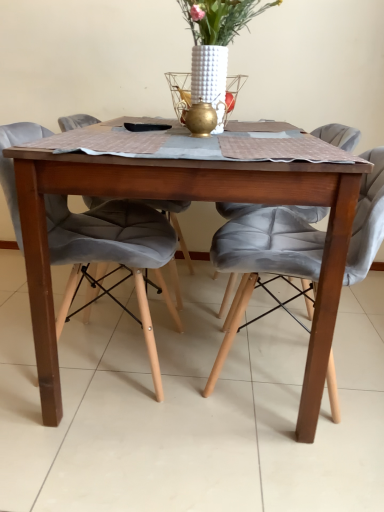
Find the location of a particular element. The width and height of the screenshot is (384, 512). velvet grey chair at center, which is counted as the first chair, starting from the left is located at coordinates (115, 254).

What do you see at coordinates (261, 259) in the screenshot? The height and width of the screenshot is (512, 384). I see `velvet grey chair at center, placed as the second chair when sorted from left to right` at bounding box center [261, 259].

Locate an element on the screen. This screenshot has height=512, width=384. velvet grey chair at center, which is counted as the first chair, starting from the left is located at coordinates (115, 254).

Based on their sizes in the image, would you say velvet grey chair at center, the second chair positioned from the right, is bigger or smaller than wooden table at center?

Considering their sizes, velvet grey chair at center, the second chair positioned from the right, takes up less space than wooden table at center.

Based on the photo, is velvet grey chair at center, the second chair positioned from the right, closer to the viewer compared to wooden table at center?

No.

From a real-world perspective, is velvet grey chair at center, the second chair positioned from the right, positioned over wooden table at center based on gravity?

Correct, in the physical world, velvet grey chair at center, the second chair positioned from the right, is higher than wooden table at center.

From the image's perspective, which object appears higher, velvet grey chair at center, the second chair positioned from the right, or wooden table at center?

wooden table at center is shown above in the image.

Would you say wooden table at center is a long distance from white textured vase at center?

Actually, wooden table at center and white textured vase at center are a little close together.

Is wooden table at center inside or outside of white textured vase at center?

wooden table at center exists outside the volume of white textured vase at center.

Between wooden table at center and white textured vase at center, which one has more height?

With more height is wooden table at center.

From the picture: From a real-world perspective, is wooden table at center below white textured vase at center?

Indeed, from a real-world perspective, wooden table at center is positioned beneath white textured vase at center.

You are a GUI agent. You are given a task and a screenshot of the screen. Output one action in this format:
    pyautogui.click(x=<x>, y=<y>)
    Task: Click on the chair that is the 2nd one when counting forward from the white textured vase at center
    Image resolution: width=384 pixels, height=512 pixels.
    Given the screenshot: What is the action you would take?
    pyautogui.click(x=261, y=259)

Between white textured vase at center and velvet grey chair at center, placed as the second chair when sorted from left to right, which one appears on the left side from the viewer's perspective?

Positioned to the left is white textured vase at center.

What's the angular difference between white textured vase at center and velvet grey chair at center, placed as the second chair when sorted from left to right,'s facing directions?

white textured vase at center and velvet grey chair at center, placed as the second chair when sorted from left to right, are facing 89.9 degrees away from each other.

Which is behind, white textured vase at center or velvet grey chair at center, which ranks as the 1th chair in right-to-left order?

white textured vase at center is behind.

Could you measure the distance between wooden table at center and velvet grey chair at center, the second chair positioned from the right?

wooden table at center is 11.86 inches away from velvet grey chair at center, the second chair positioned from the right.

How different are the orientations of wooden table at center and velvet grey chair at center, which is counted as the first chair, starting from the left, in degrees?

They differ by 90 degrees in their facing directions.

Can you confirm if wooden table at center is positioned to the right of velvet grey chair at center, the second chair positioned from the right?

Yes, wooden table at center is to the right of velvet grey chair at center, the second chair positioned from the right.

Considering the relative sizes of wooden table at center and velvet grey chair at center, which is counted as the first chair, starting from the left, in the image provided, is wooden table at center taller than velvet grey chair at center, which is counted as the first chair, starting from the left,?

In fact, wooden table at center may be shorter than velvet grey chair at center, which is counted as the first chair, starting from the left.

From a real-world perspective, who is located lower, velvet grey chair at center, which is counted as the first chair, starting from the left, or white textured vase at center?

velvet grey chair at center, which is counted as the first chair, starting from the left.

From their relative heights in the image, would you say velvet grey chair at center, the second chair positioned from the right, is taller or shorter than white textured vase at center?

velvet grey chair at center, the second chair positioned from the right, is taller than white textured vase at center.

How different are the orientations of velvet grey chair at center, the second chair positioned from the right, and white textured vase at center in degrees?

The facing directions of velvet grey chair at center, the second chair positioned from the right, and white textured vase at center are 90.1 degrees apart.

From the image's perspective, relative to white textured vase at center, is velvet grey chair at center, which is counted as the first chair, starting from the left, above or below?

Clearly, from the image's perspective, velvet grey chair at center, which is counted as the first chair, starting from the left, is below white textured vase at center.

From the picture: Considering the positions of objects velvet grey chair at center, which is counted as the first chair, starting from the left, and velvet grey chair at center, placed as the second chair when sorted from left to right, in the image provided, who is more to the right, velvet grey chair at center, which is counted as the first chair, starting from the left, or velvet grey chair at center, placed as the second chair when sorted from left to right,?

velvet grey chair at center, placed as the second chair when sorted from left to right.

Find the location of a particular element. The image size is (384, 512). chair located in front of the velvet grey chair at center, the second chair positioned from the right is located at coordinates (261, 259).

Does velvet grey chair at center, the second chair positioned from the right, have a lesser height compared to velvet grey chair at center, placed as the second chair when sorted from left to right?

In fact, velvet grey chair at center, the second chair positioned from the right, may be taller than velvet grey chair at center, placed as the second chair when sorted from left to right.

Considering the relative sizes of wooden table at center and velvet grey chair at center, which ranks as the 1th chair in right-to-left order, in the image provided, is wooden table at center wider than velvet grey chair at center, which ranks as the 1th chair in right-to-left order,?

Yes.

Considering the relative positions of wooden table at center and velvet grey chair at center, which ranks as the 1th chair in right-to-left order, in the image provided, is wooden table at center in front of velvet grey chair at center, which ranks as the 1th chair in right-to-left order,?

Yes, wooden table at center is closer to the camera.

Considering the sizes of objects wooden table at center and velvet grey chair at center, placed as the second chair when sorted from left to right, in the image provided, who is shorter, wooden table at center or velvet grey chair at center, placed as the second chair when sorted from left to right,?

Standing shorter between the two is velvet grey chair at center, placed as the second chair when sorted from left to right.

Which is more to the right, wooden table at center or velvet grey chair at center, which ranks as the 1th chair in right-to-left order?

From the viewer's perspective, velvet grey chair at center, which ranks as the 1th chair in right-to-left order, appears more on the right side.

Identify the location of the 1st chair below the wooden table at center (from the image's perspective). (115, 254).

The width and height of the screenshot is (384, 512). Find the location of `kitchen & dining room table in front of the white textured vase at center`. kitchen & dining room table in front of the white textured vase at center is located at coordinates (188, 199).

From the image, which object appears to be farther from velvet grey chair at center, the second chair positioned from the right, wooden table at center or white textured vase at center?

white textured vase at center is further to velvet grey chair at center, the second chair positioned from the right.

Looking at this image, when comparing their distances from white textured vase at center, does velvet grey chair at center, which ranks as the 1th chair in right-to-left order, or wooden table at center seem further?

Among the two, wooden table at center is located further to white textured vase at center.

From the image, which object appears to be farther from velvet grey chair at center, which ranks as the 1th chair in right-to-left order, wooden table at center or velvet grey chair at center, the second chair positioned from the right?

Based on the image, velvet grey chair at center, the second chair positioned from the right, appears to be further to velvet grey chair at center, which ranks as the 1th chair in right-to-left order.

Looking at the image, which one is located further to velvet grey chair at center, which ranks as the 1th chair in right-to-left order, velvet grey chair at center, the second chair positioned from the right, or wooden table at center?

Among the two, velvet grey chair at center, the second chair positioned from the right, is located further to velvet grey chair at center, which ranks as the 1th chair in right-to-left order.

Looking at the image, which one is located closer to velvet grey chair at center, which is counted as the first chair, starting from the left, velvet grey chair at center, which ranks as the 1th chair in right-to-left order, or white textured vase at center?

velvet grey chair at center, which ranks as the 1th chair in right-to-left order, lies closer to velvet grey chair at center, which is counted as the first chair, starting from the left, than the other object.

Looking at the image, which one is located further to velvet grey chair at center, the second chair positioned from the right, wooden table at center or velvet grey chair at center, which ranks as the 1th chair in right-to-left order?

velvet grey chair at center, which ranks as the 1th chair in right-to-left order, is further to velvet grey chair at center, the second chair positioned from the right.

Estimate the real-world distances between objects in this image. Which object is further from velvet grey chair at center, placed as the second chair when sorted from left to right, wooden table at center or white textured vase at center?

Among the two, white textured vase at center is located further to velvet grey chair at center, placed as the second chair when sorted from left to right.

Which object lies nearer to the anchor point velvet grey chair at center, the second chair positioned from the right, white textured vase at center or wooden table at center?

wooden table at center is closer to velvet grey chair at center, the second chair positioned from the right.

What are the coordinates of `kitchen & dining room table located between velvet grey chair at center, the second chair positioned from the right, and velvet grey chair at center, which ranks as the 1th chair in right-to-left order, in the left-right direction` in the screenshot? It's located at (188, 199).

Find the location of a particular element. The height and width of the screenshot is (512, 384). chair between white textured vase at center and velvet grey chair at center, which ranks as the 1th chair in right-to-left order, in the vertical direction is located at coordinates (115, 254).

You are a GUI agent. You are given a task and a screenshot of the screen. Output one action in this format:
    pyautogui.click(x=<x>, y=<y>)
    Task: Click on the kitchen & dining room table between white textured vase at center and velvet grey chair at center, placed as the second chair when sorted from left to right, vertically
    The width and height of the screenshot is (384, 512).
    Given the screenshot: What is the action you would take?
    pyautogui.click(x=188, y=199)

This screenshot has height=512, width=384. Find the location of `kitchen & dining room table between white textured vase at center and velvet grey chair at center, the second chair positioned from the right, vertically`. kitchen & dining room table between white textured vase at center and velvet grey chair at center, the second chair positioned from the right, vertically is located at coordinates (188, 199).